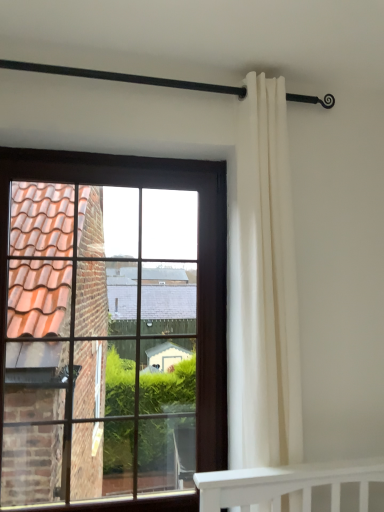
Question: From a real-world perspective, does black metal rod at upper center sit lower than white fabric curtain at right?

Choices:
 (A) no
 (B) yes

Answer: (A)

Question: Is black metal rod at upper center further to camera compared to white fabric curtain at right?

Choices:
 (A) yes
 (B) no

Answer: (B)

Question: From the image's perspective, is black metal rod at upper center beneath white fabric curtain at right?

Choices:
 (A) yes
 (B) no

Answer: (B)

Question: Would you say black metal rod at upper center is outside white fabric curtain at right?

Choices:
 (A) no
 (B) yes

Answer: (B)

Question: Is black metal rod at upper center shorter than white fabric curtain at right?

Choices:
 (A) yes
 (B) no

Answer: (A)

Question: Is black metal rod at upper center at the right side of white fabric curtain at right?

Choices:
 (A) no
 (B) yes

Answer: (A)

Question: Does brown wooden window at left have a smaller size compared to white fabric curtain at right?

Choices:
 (A) no
 (B) yes

Answer: (A)

Question: Are brown wooden window at left and white fabric curtain at right located far from each other?

Choices:
 (A) yes
 (B) no

Answer: (A)

Question: From a real-world perspective, is brown wooden window at left positioned under white fabric curtain at right based on gravity?

Choices:
 (A) yes
 (B) no

Answer: (A)

Question: From the image's perspective, is brown wooden window at left under white fabric curtain at right?

Choices:
 (A) yes
 (B) no

Answer: (A)

Question: Could white fabric curtain at right be considered to be inside brown wooden window at left?

Choices:
 (A) no
 (B) yes

Answer: (A)

Question: Is brown wooden window at left completely or partially outside of white fabric curtain at right?

Choices:
 (A) yes
 (B) no

Answer: (A)

Question: From the image's perspective, is brown wooden window at left under black metal rod at upper center?

Choices:
 (A) yes
 (B) no

Answer: (A)